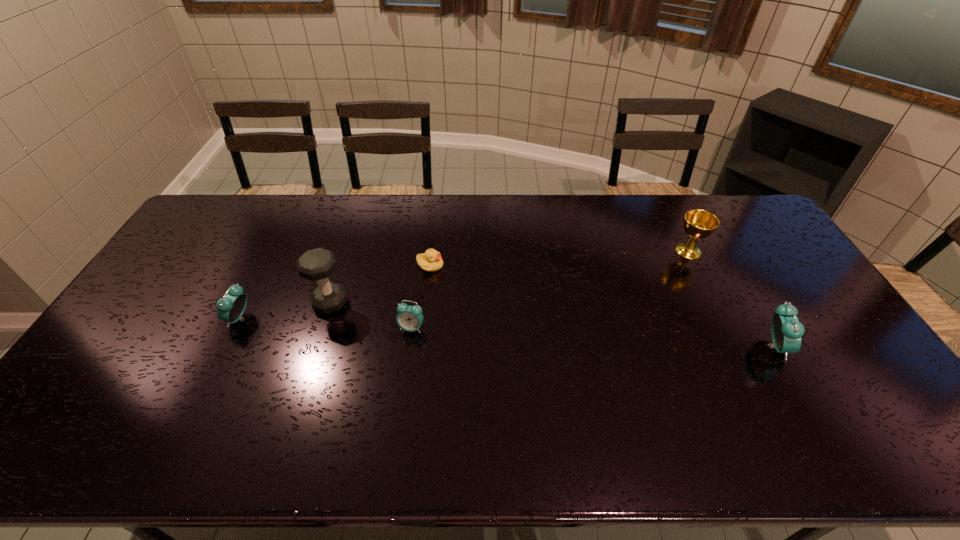
In the image, there is a desktop. Identify the location of free space at the left edge. (115, 335).

Where is `vacant space at the near left corner`? vacant space at the near left corner is located at coordinates (61, 405).

At what (x,y) coordinates should I click in order to perform the action: click on free location at the far right corner of the desktop. Please return your answer as a coordinate pair (x, y). The image size is (960, 540). Looking at the image, I should click on (711, 201).

Where is `empty space between the second alarm clock from left to right and the tallest alarm clock`? This screenshot has width=960, height=540. empty space between the second alarm clock from left to right and the tallest alarm clock is located at coordinates click(x=592, y=337).

Locate an element on the screen. Image resolution: width=960 pixels, height=540 pixels. vacant region between the shortest alarm clock and the tallest alarm clock is located at coordinates pos(592,337).

Image resolution: width=960 pixels, height=540 pixels. Find the location of `free spot between the shortest object and the fifth object from left to right`. free spot between the shortest object and the fifth object from left to right is located at coordinates (560, 258).

The image size is (960, 540). Identify the location of vacant space that is in between the second alarm clock from right to left and the rightmost alarm clock. (592, 337).

Locate an element on the screen. This screenshot has height=540, width=960. free spot between the shortest object and the tallest alarm clock is located at coordinates (602, 306).

Locate an element on the screen. vacant region between the tallest object and the fifth object from left to right is located at coordinates (510, 277).

Where is `vacant space that's between the shortest object and the rightmost alarm clock`? This screenshot has height=540, width=960. vacant space that's between the shortest object and the rightmost alarm clock is located at coordinates (602, 306).